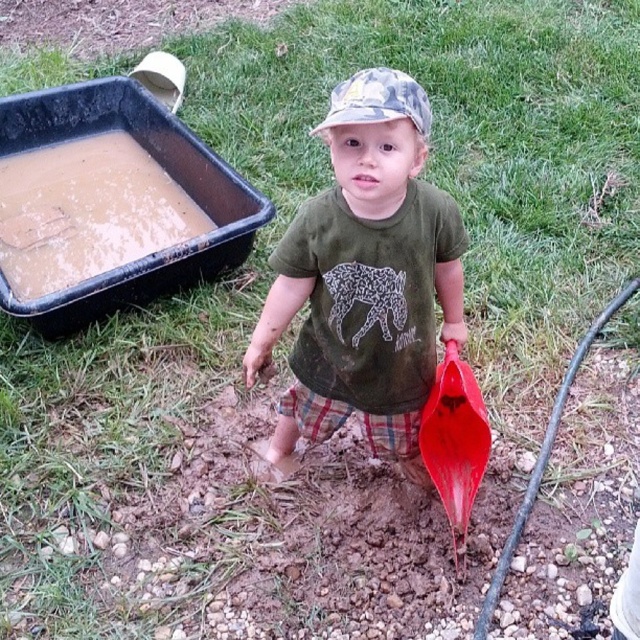
You are a photographer trying to capture a closeup of the green matte shirt at center and the shiny plastic shovel at lower center in the image. Given that your camera can only focus on objects within a 7 inch range, will both items be in focus?

The green matte shirt at center and shiny plastic shovel at lower center are 7.27 inches apart from each other. Since the distance between them exceeds the camera focus range of 7 inches, they might not both be in focus.

Looking at this image, the child is holding a red shovel. You want to place a new toy next to the green matte shirt at center so it is closer to the camouflage fabric cap at center than the shirt. Where should you put the new toy?

Place the new toy to the right of the green matte shirt at center so it is closer to the camouflage fabric cap at center than the shirt.

Based on the scene description, if you were to draw a vertical line from the top of the green matte shirt at center to the ground, would this line pass over the camouflage fabric cap at center?

Yes, because the green matte shirt at center is taller than the camouflage fabric cap at center, so a vertical line from the shirt would extend downward past the cap.